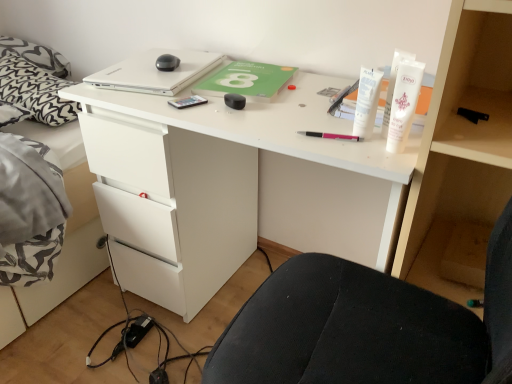
Question: Is white matte laptop at upper center not near black rubberized mouse at center, the 3th stationery in the front-to-back sequence?

Choices:
 (A) yes
 (B) no

Answer: (B)

Question: From a real-world perspective, is white matte laptop at upper center below black rubberized mouse at center, the 3th stationery in the front-to-back sequence?

Choices:
 (A) no
 (B) yes

Answer: (A)

Question: Does white matte laptop at upper center have a smaller size compared to black rubberized mouse at center, which is counted as the second stationery, starting from the back?

Choices:
 (A) no
 (B) yes

Answer: (A)

Question: Can you confirm if white matte laptop at upper center is bigger than black rubberized mouse at center, arranged as the 3th stationery when viewed from the right?

Choices:
 (A) no
 (B) yes

Answer: (B)

Question: Is white matte laptop at upper center facing away from black rubberized mouse at center, arranged as the 3th stationery when viewed from the right?

Choices:
 (A) yes
 (B) no

Answer: (B)

Question: From the image's perspective, is white matte laptop at upper center below black rubberized mouse at center, arranged as the 3th stationery when viewed from the right?

Choices:
 (A) no
 (B) yes

Answer: (A)

Question: Is white matte desk at center directly adjacent to black rubberized mouse at center, which is counted as the second stationery, starting from the back?

Choices:
 (A) no
 (B) yes

Answer: (A)

Question: Is white matte desk at center oriented away from black rubberized mouse at center, arranged as the 3th stationery when viewed from the right?

Choices:
 (A) yes
 (B) no

Answer: (B)

Question: Is white matte desk at center at the left side of black rubberized mouse at center, which is counted as the second stationery, starting from the back?

Choices:
 (A) yes
 (B) no

Answer: (B)

Question: Is white matte desk at center not inside black rubberized mouse at center, the 3th stationery in the front-to-back sequence?

Choices:
 (A) yes
 (B) no

Answer: (A)

Question: Can you confirm if white matte desk at center is bigger than black rubberized mouse at center, the 3th stationery in the front-to-back sequence?

Choices:
 (A) yes
 (B) no

Answer: (A)

Question: From the image's perspective, does white matte desk at center appear higher than black rubberized mouse at center, which is counted as the second stationery, starting from the back?

Choices:
 (A) yes
 (B) no

Answer: (B)

Question: Can you confirm if white matte tube at upper right, the 1th toiletry in the left-to-right sequence, is smaller than black rubberized mouse at center, arranged as the 3th stationery when viewed from the right?

Choices:
 (A) no
 (B) yes

Answer: (A)